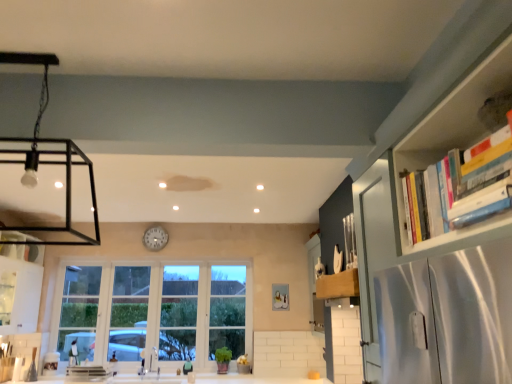
Question: Could clear glass window at center be considered to be inside hardcover books at upper right?

Choices:
 (A) no
 (B) yes

Answer: (A)

Question: Does hardcover books at upper right appear on the right side of clear glass window at center?

Choices:
 (A) yes
 (B) no

Answer: (A)

Question: From the image's perspective, is hardcover books at upper right on top of clear glass window at center?

Choices:
 (A) no
 (B) yes

Answer: (B)

Question: Can you confirm if hardcover books at upper right is wider than clear glass window at center?

Choices:
 (A) yes
 (B) no

Answer: (A)

Question: Does hardcover books at upper right come in front of clear glass window at center?

Choices:
 (A) no
 (B) yes

Answer: (B)

Question: From the image's perspective, would you say hardcover books at upper right is shown under clear glass window at center?

Choices:
 (A) no
 (B) yes

Answer: (A)

Question: Is wooden knife block at upper right, which is the first cabinetry in right-to-left order, to the right of metallic silver sink at lower center from the viewer's perspective?

Choices:
 (A) yes
 (B) no

Answer: (A)

Question: Is wooden knife block at upper right, which is counted as the second cabinetry, starting from the left, facing away from metallic silver sink at lower center?

Choices:
 (A) yes
 (B) no

Answer: (B)

Question: Is the surface of wooden knife block at upper right, which is counted as the second cabinetry, starting from the left, in direct contact with metallic silver sink at lower center?

Choices:
 (A) yes
 (B) no

Answer: (B)

Question: From a real-world perspective, is wooden knife block at upper right, which is the first cabinetry in right-to-left order, on metallic silver sink at lower center?

Choices:
 (A) yes
 (B) no

Answer: (A)

Question: From a real-world perspective, is wooden knife block at upper right, which is counted as the second cabinetry, starting from the left, positioned under metallic silver sink at lower center based on gravity?

Choices:
 (A) yes
 (B) no

Answer: (B)

Question: Does wooden knife block at upper right, which is the first cabinetry in right-to-left order, have a greater width compared to metallic silver sink at lower center?

Choices:
 (A) no
 (B) yes

Answer: (A)

Question: Can you confirm if clear glass window at center is bigger than wooden knife block at upper right, which is the first cabinetry in right-to-left order?

Choices:
 (A) yes
 (B) no

Answer: (A)